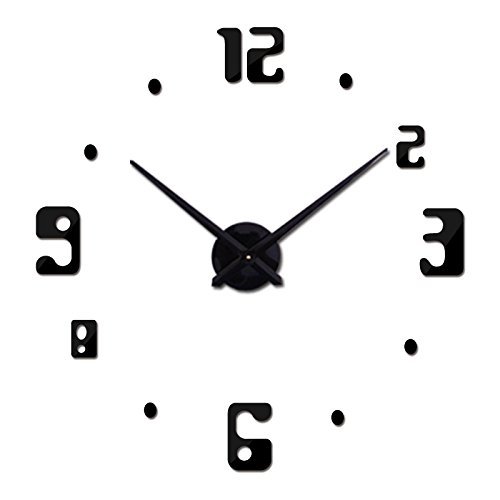
You are a GUI agent. You are given a task and a screenshot of the screen. Output one action in this format:
    pyautogui.click(x=<x>, y=<y>)
    Task: Click on the silver screw
    The width and height of the screenshot is (500, 500).
    Given the screenshot: What is the action you would take?
    pyautogui.click(x=249, y=258)